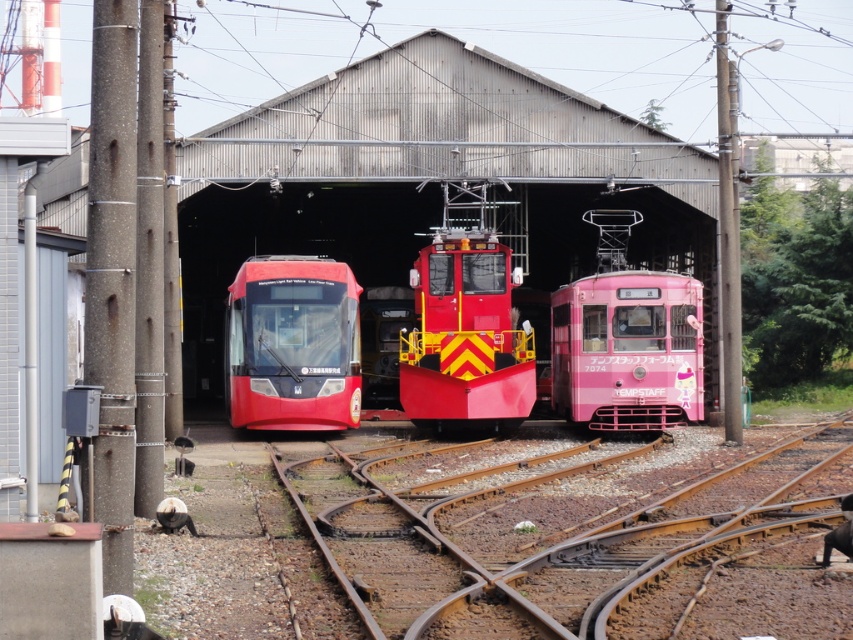
You are a maintenance worker needing to move a large equipment crate that is 3 meters wide. You see the pink glossy tram at center and the matte black train at center. Which vehicle can accommodate the crate based on their widths?

The pink glossy tram at center has a greater width than the matte black train at center, so the crate can fit on the pink glossy tram at center.

You are a maintenance worker standing on the brown metal train track at center. You need to reach the pink glossy tram at center for inspection. Which direction should you move to get there?

The brown metal train track at center is located below the pink glossy tram at center, so you should move upward to reach the pink glossy tram at center.

Based on the coordinates provided, what object is located at point (550, 522) in the image?

The point (550, 522) marks the brown metal train track at center.